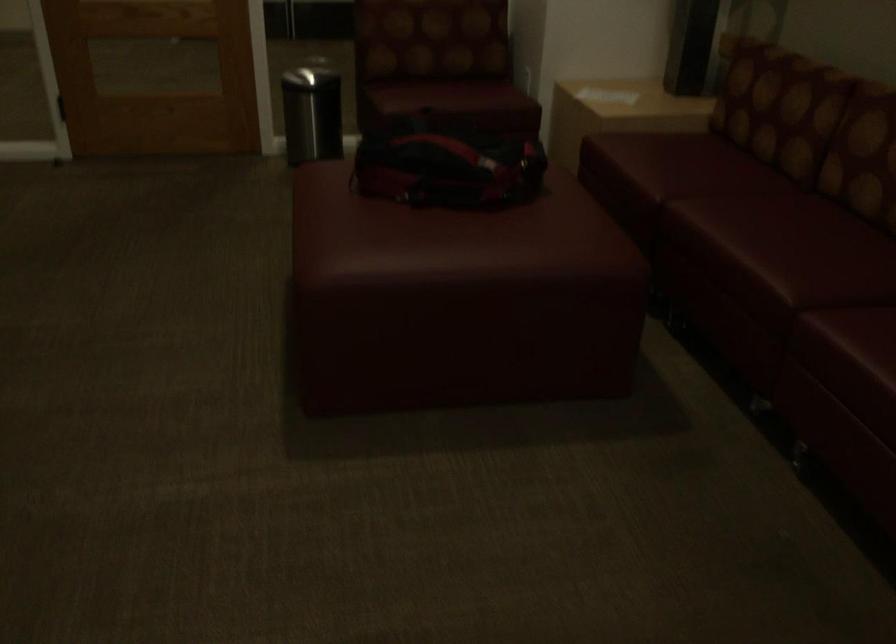
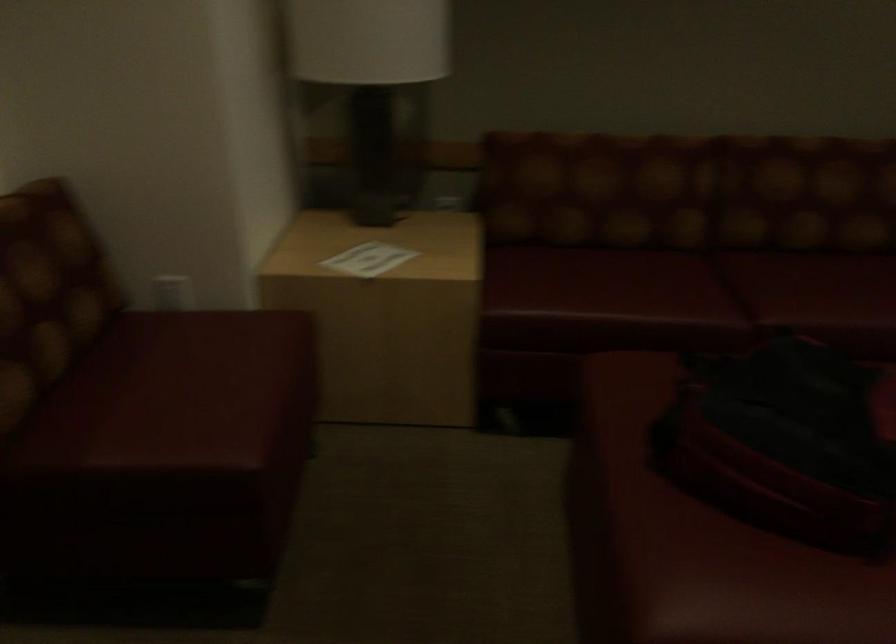
In the second image, find the point that corresponds to [397,140] in the first image.

(786, 442)